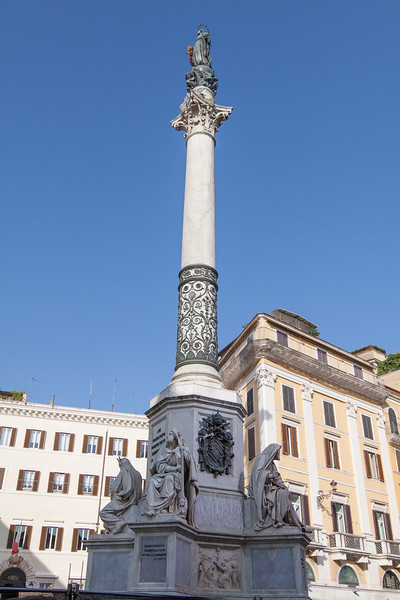
Where is `metallic fixtures`? The height and width of the screenshot is (600, 400). metallic fixtures is located at coordinates (59, 589), (108, 593), (205, 339), (222, 443).